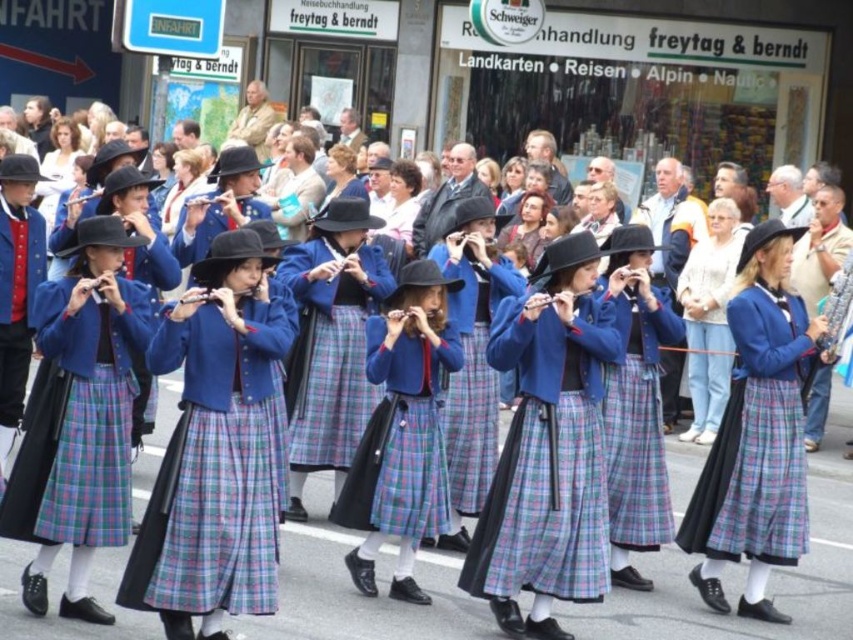
Question: Which point is farther to the camera?

Choices:
 (A) (343, 524)
 (B) (793, 524)

Answer: (A)

Question: Which point is closer to the camera taking this photo?

Choices:
 (A) (457, 339)
 (B) (793, 512)

Answer: (B)

Question: Is matte blue jacket at center closer to the viewer compared to plaid wool skirt at center?

Choices:
 (A) no
 (B) yes

Answer: (B)

Question: Does matte blue jacket at center lie in front of plaid wool skirt at center?

Choices:
 (A) no
 (B) yes

Answer: (B)

Question: Does matte blue jacket at center have a greater width compared to plaid wool skirt at center?

Choices:
 (A) yes
 (B) no

Answer: (B)